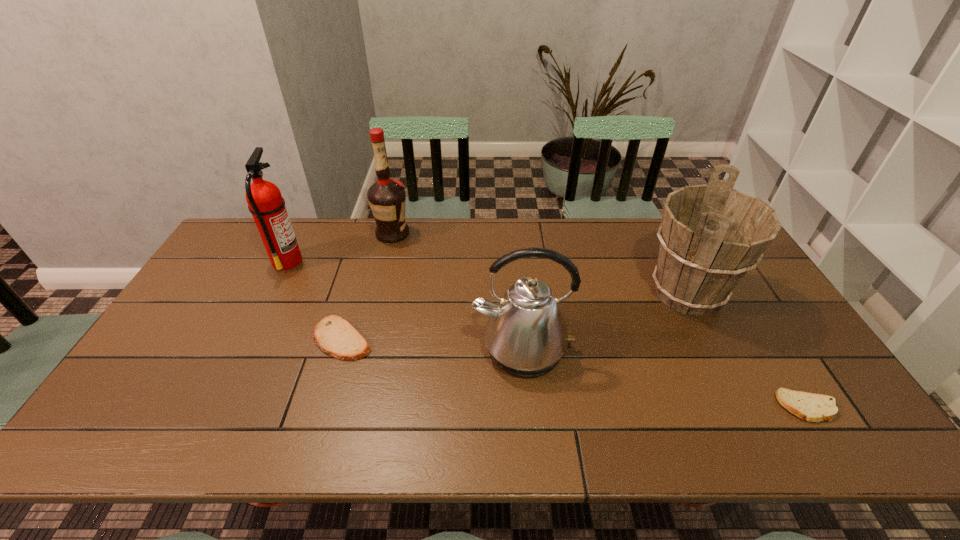
In the image, there is a desktop. Identify the location of free space at the far edge. (463, 240).

The image size is (960, 540). In order to click on free region at the near edge of the desktop in this screenshot , I will do `click(673, 419)`.

Where is `vacant region between the leftmost object and the bucket`? The height and width of the screenshot is (540, 960). vacant region between the leftmost object and the bucket is located at coordinates (488, 277).

This screenshot has height=540, width=960. I want to click on vacant point located between the bucket and the farthest object, so click(x=540, y=264).

What are the coordinates of `free space between the third object from right to left and the bucket` in the screenshot? It's located at (605, 322).

Image resolution: width=960 pixels, height=540 pixels. Find the location of `vacant space that's between the bucket and the liquor`. vacant space that's between the bucket and the liquor is located at coordinates (540, 264).

Find the location of a particular element. The height and width of the screenshot is (540, 960). vacant area that lies between the nearest object and the bucket is located at coordinates (747, 350).

Identify the location of free space that is in between the kettle and the leftmost object. (405, 306).

The image size is (960, 540). I want to click on unoccupied position between the leftmost object and the liquor, so click(x=340, y=247).

Image resolution: width=960 pixels, height=540 pixels. What are the coordinates of `vacant point located between the shorter pita bread and the fifth tallest object` in the screenshot? It's located at (575, 373).